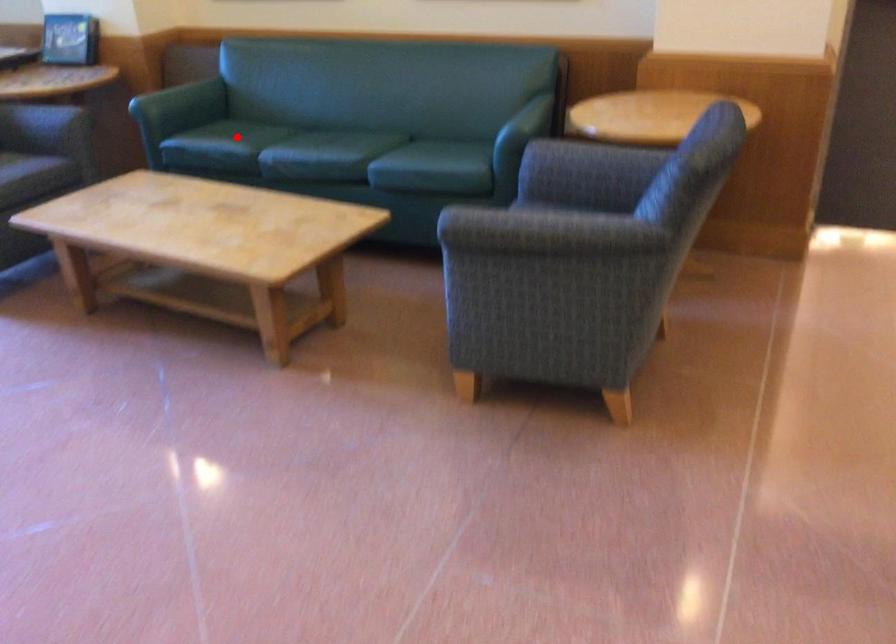
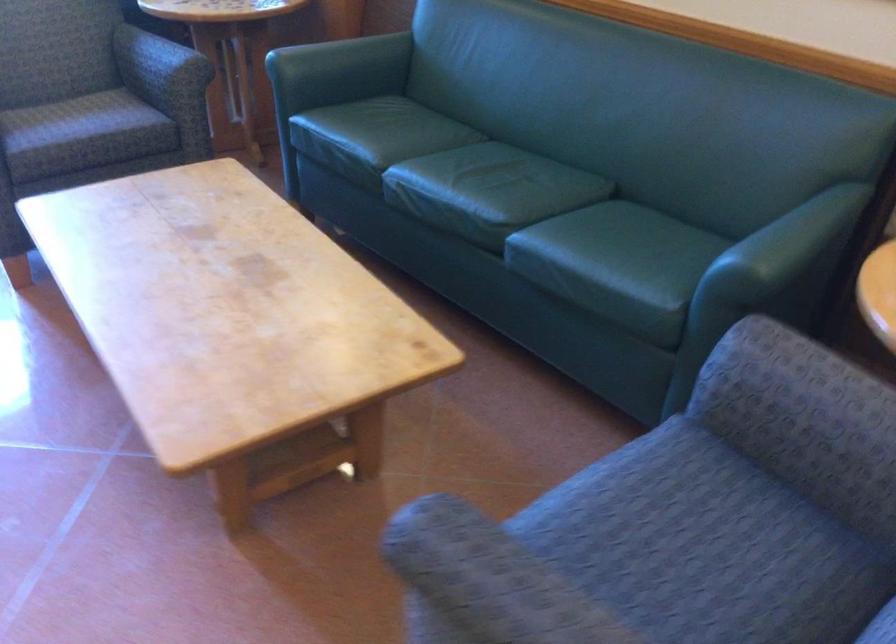
Question: I am providing you with two images of the same scene from different viewpoints. Given a red point in image1, look at the same physical point in image2. Is it:

Choices:
 (A) Closer to the viewpoint
 (B) Farther from the viewpoint

Answer: (A)